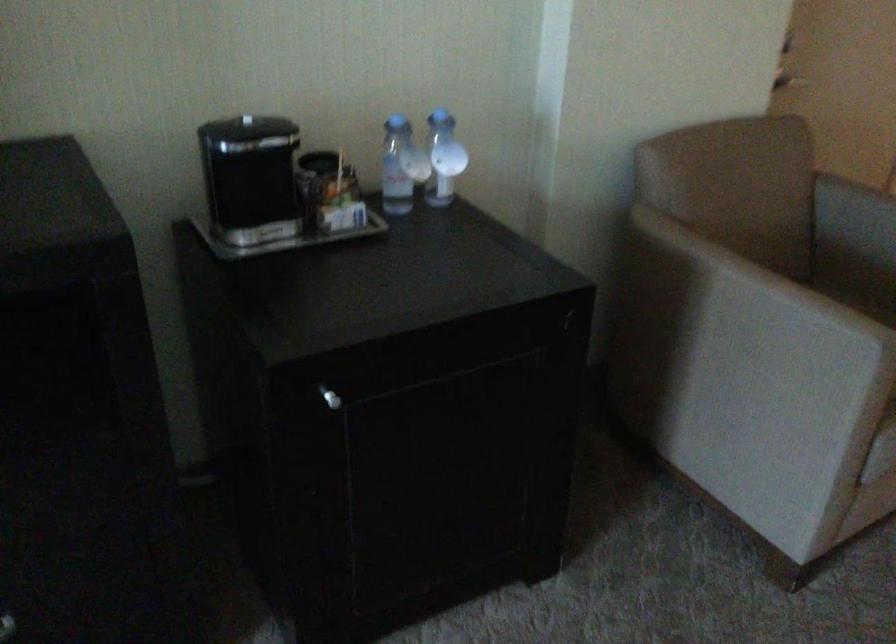
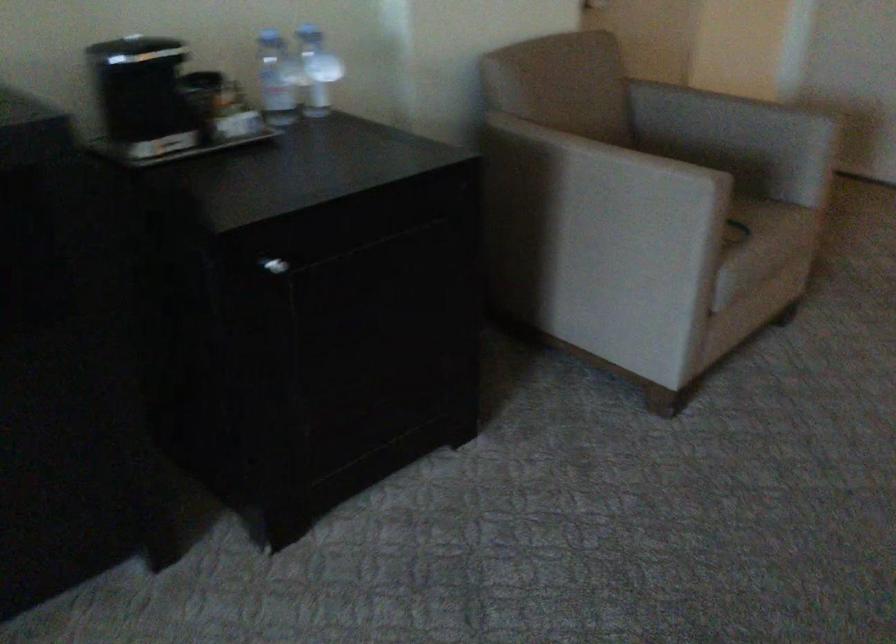
Which direction would the cameraman need to move to produce the second image?

The cameraman walked toward left, backward.